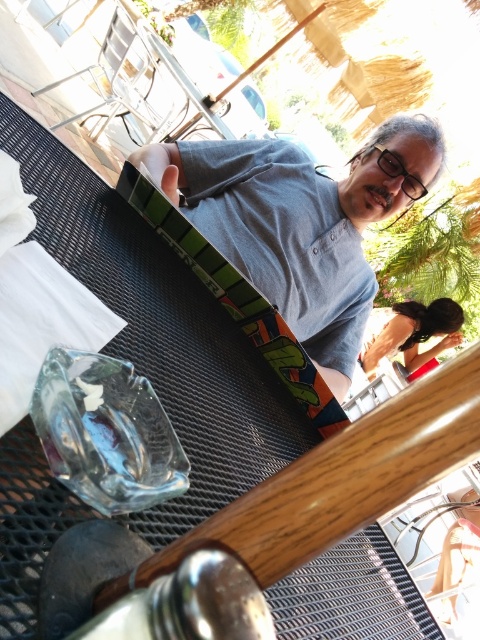
Between point (425, 125) and point (456, 332), which one is positioned in front?

Positioned in front is point (425, 125).

Measure the distance between gray matte t-shirt at center and camera.

A distance of 30.71 inches exists between gray matte t-shirt at center and camera.

You are a GUI agent. You are given a task and a screenshot of the screen. Output one action in this format:
    pyautogui.click(x=<x>, y=<y>)
    Task: Click on the gray matte t-shirt at center
    This screenshot has width=480, height=640.
    Given the screenshot: What is the action you would take?
    pyautogui.click(x=301, y=221)